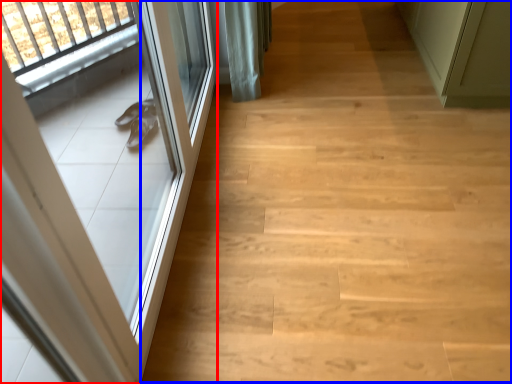
Question: Which point is closer to the camera, door (highlighted by a red box) or stairwell (highlighted by a blue box)?

Choices:
 (A) door
 (B) stairwell

Answer: (A)